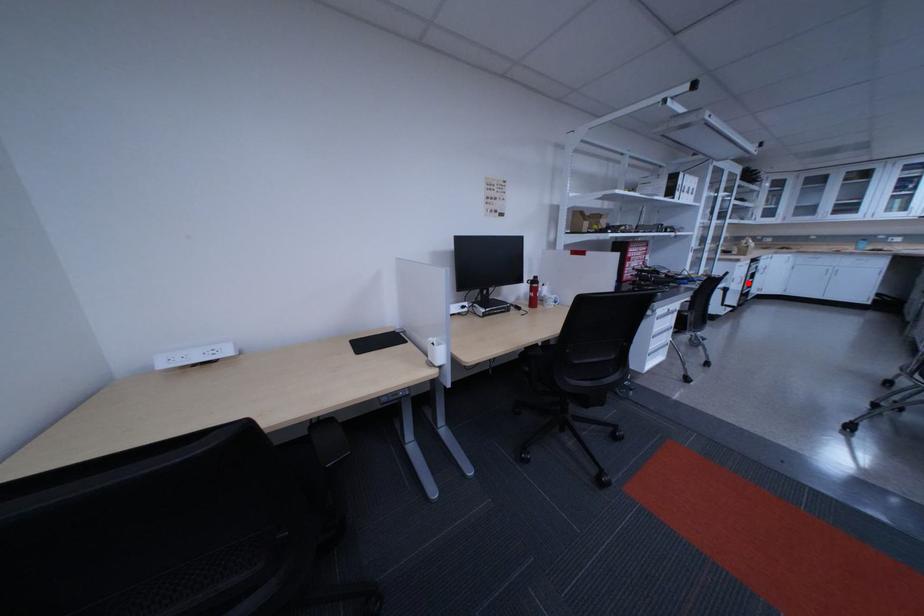
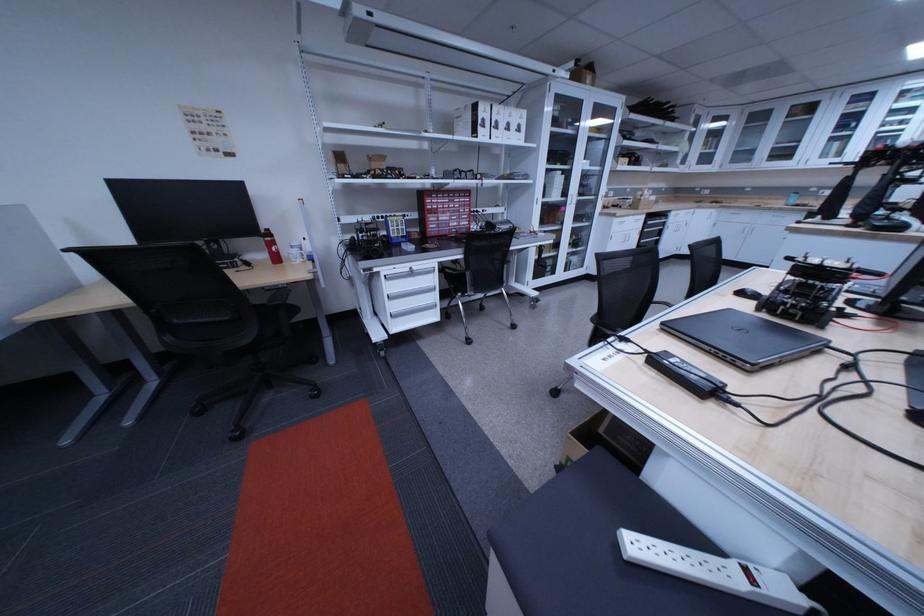
Question: I am providing you with two images of the same scene from different viewpoints. A red point is shown in image1. For the corresponding object point in image2, is it positioned nearer or farther from the camera?

Choices:
 (A) Nearer
 (B) Farther

Answer: (A)